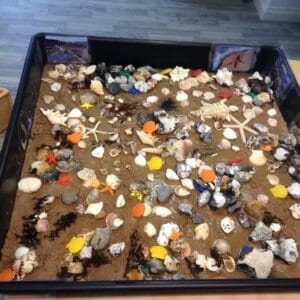
Identify the location of sides of the tray. (170, 54), (31, 88), (290, 106).